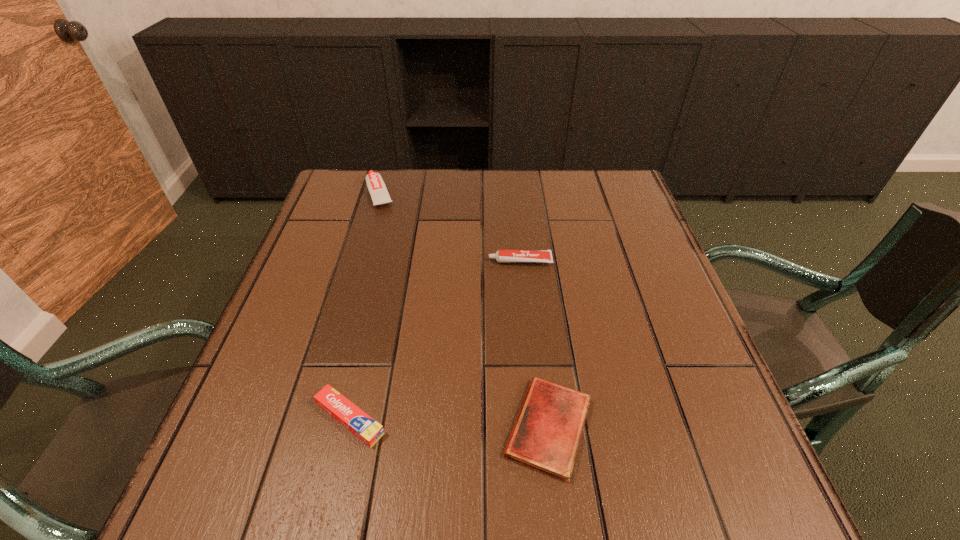
The width and height of the screenshot is (960, 540). Find the location of `the farthest object`. the farthest object is located at coordinates (376, 186).

Where is `the farthest toothpaste`? the farthest toothpaste is located at coordinates (376, 186).

This screenshot has height=540, width=960. In order to click on the second nearest toothpaste in this screenshot , I will do `click(502, 256)`.

At what (x,y) coordinates should I click in order to perform the action: click on the second shortest toothpaste. Please return your answer as a coordinate pair (x, y). The width and height of the screenshot is (960, 540). Looking at the image, I should click on (502, 256).

Locate an element on the screen. the nearest toothpaste is located at coordinates (363, 426).

The width and height of the screenshot is (960, 540). What are the coordinates of `the shortest toothpaste` in the screenshot? It's located at (363, 426).

At what (x,y) coordinates should I click in order to perform the action: click on diary. Please return your answer as a coordinate pair (x, y). This screenshot has height=540, width=960. Looking at the image, I should click on (546, 436).

The image size is (960, 540). I want to click on vacant space located on the right of the tallest toothpaste, so click(503, 193).

The width and height of the screenshot is (960, 540). Identify the location of vacant space positioned 0.070m at the nozzle of the second shortest toothpaste. (460, 261).

Locate an element on the screen. This screenshot has width=960, height=540. blank space located at the nozzle of the second shortest toothpaste is located at coordinates click(x=336, y=261).